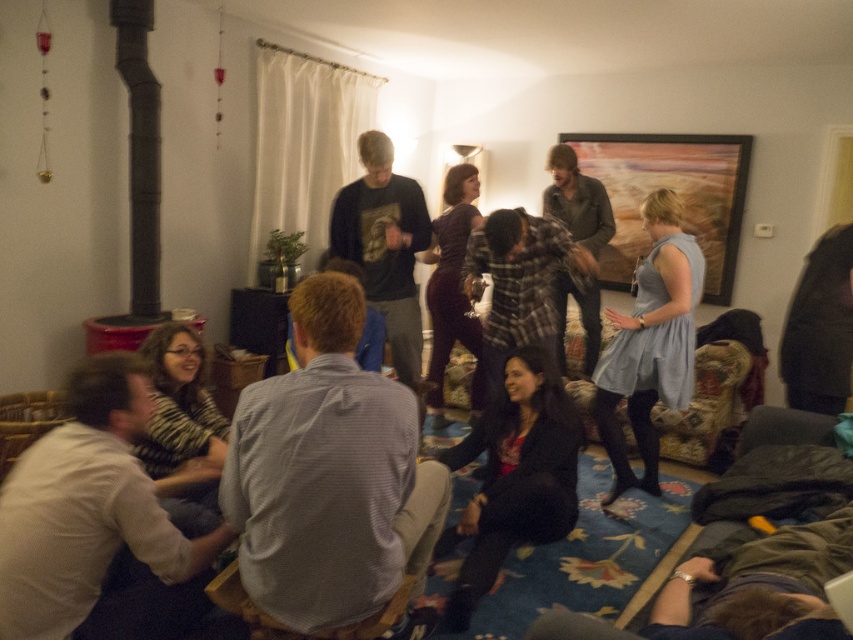
Question: Does black velvet dress at center lie behind light blue fabric dress at center?

Choices:
 (A) yes
 (B) no

Answer: (B)

Question: Can you confirm if light blue fabric dress at center is positioned below black matte pipe at left?

Choices:
 (A) no
 (B) yes

Answer: (B)

Question: Which object appears farthest from the camera in this image?

Choices:
 (A) black velvet dress at center
 (B) light blue fabric dress at center

Answer: (B)

Question: Which is farther from the black velvet dress at center?

Choices:
 (A) black matte pipe at left
 (B) light blue fabric dress at center

Answer: (A)

Question: Does black velvet dress at center appear on the right side of light blue fabric dress at center?

Choices:
 (A) no
 (B) yes

Answer: (A)

Question: Which object appears farthest from the camera in this image?

Choices:
 (A) black velvet dress at center
 (B) light blue fabric dress at center
 (C) black matte pipe at left

Answer: (C)